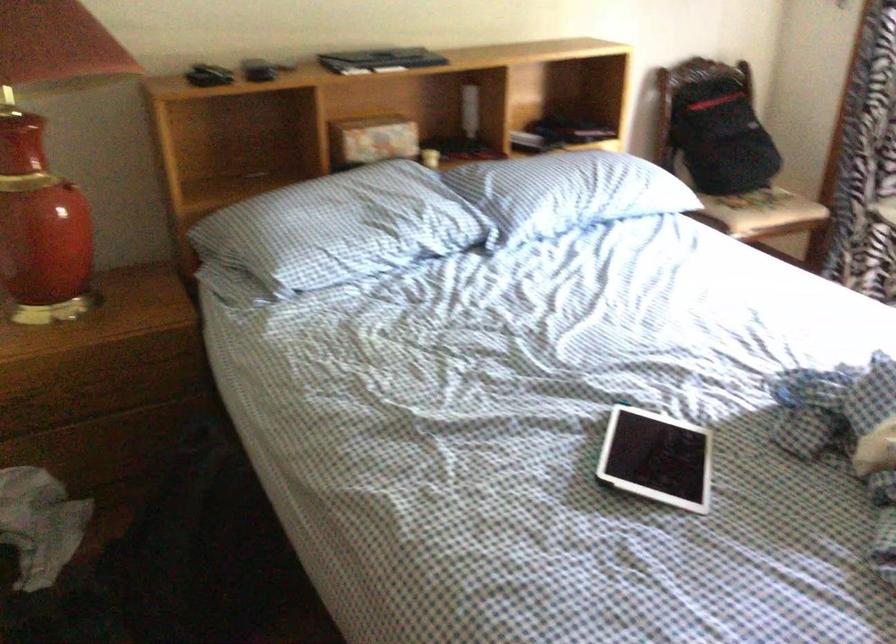
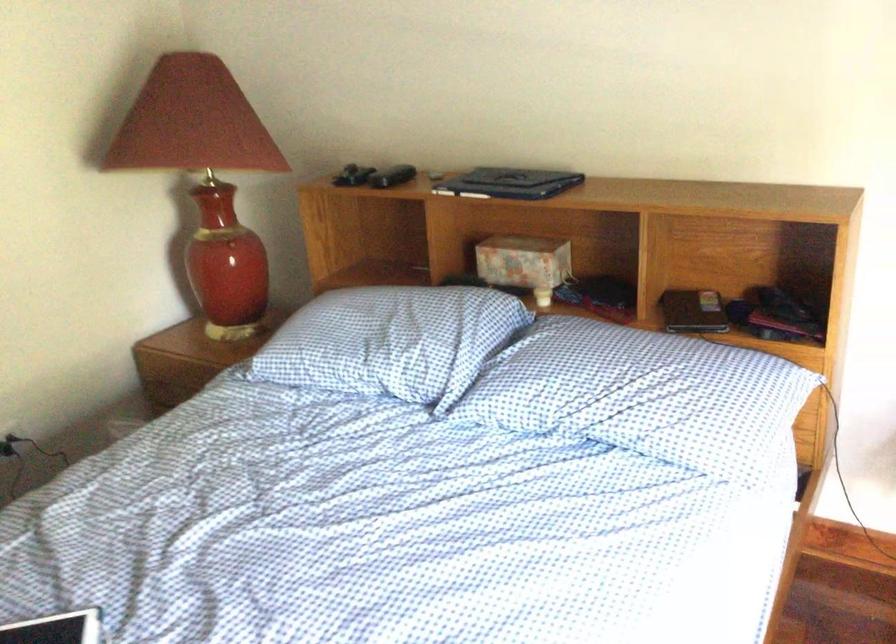
Where in the second image is the point corresponding to pixel 389 219 from the first image?

(384, 342)